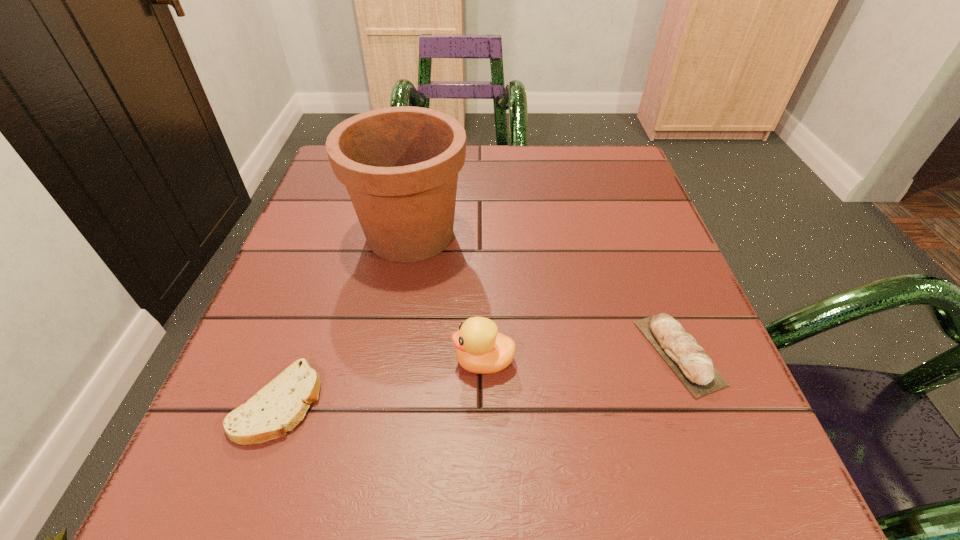
Where is `the tallest object`? The height and width of the screenshot is (540, 960). the tallest object is located at coordinates click(400, 165).

Image resolution: width=960 pixels, height=540 pixels. Find the location of `the farthest object`. the farthest object is located at coordinates (400, 165).

Image resolution: width=960 pixels, height=540 pixels. In order to click on duckling in this screenshot , I will do `click(481, 349)`.

Image resolution: width=960 pixels, height=540 pixels. In order to click on the taller pita bread in this screenshot , I will do `click(689, 361)`.

Identify the location of the rightmost object. (689, 361).

The height and width of the screenshot is (540, 960). I want to click on the shorter pita bread, so click(278, 407).

You are a GUI agent. You are given a task and a screenshot of the screen. Output one action in this format:
    pyautogui.click(x=<x>, y=<y>)
    Task: Click on the left pita bread
    
    Given the screenshot: What is the action you would take?
    coord(278,407)

Where is `free region located on the front of the flowerpot`? The image size is (960, 540). free region located on the front of the flowerpot is located at coordinates (388, 366).

In order to click on free point located on the face of the duckling in this screenshot , I will do `click(300, 362)`.

Identify the location of vacant area situated on the face of the duckling. This screenshot has width=960, height=540. (339, 362).